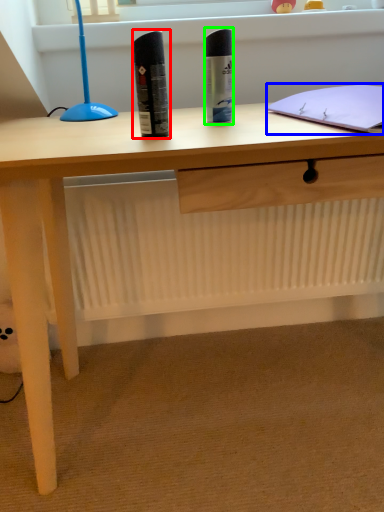
Question: Based on their relative distances, which object is nearer to stationery (highlighted by a red box)? Choose from notebook (highlighted by a blue box) and stationery (highlighted by a green box).

Choices:
 (A) notebook
 (B) stationery

Answer: (B)